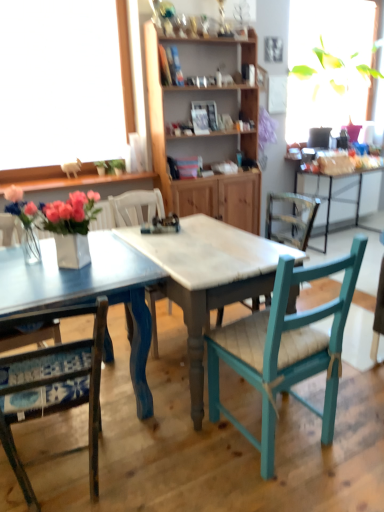
What do you see at coordinates (285, 349) in the screenshot? This screenshot has width=384, height=512. I see `teal wood chair at center, the 1th chair viewed from the right` at bounding box center [285, 349].

Measure the distance between teal wood chair at center, the 1th chair viewed from the right, and camera.

They are 4.40 feet apart.

Locate an element on the screen. wooden cabinet at center is located at coordinates (197, 138).

Describe the element at coordinates (209, 278) in the screenshot. I see `white marble table at center` at that location.

The height and width of the screenshot is (512, 384). Describe the element at coordinates (212, 438) in the screenshot. I see `blue painted wood table at center` at that location.

You are a GUI agent. You are given a task and a screenshot of the screen. Output one action in this format:
    pyautogui.click(x=<x>, y=<y>)
    Task: Click on the teal wood chair at center, the third chair when ordered from left to right
    The height and width of the screenshot is (512, 384).
    Given the screenshot: What is the action you would take?
    pyautogui.click(x=285, y=349)

From the picture: Which is more to the right, wooden cabinet at center or blue painted wood table at center?

wooden cabinet at center.

Between wooden cabinet at center and blue painted wood table at center, which one has smaller width?

wooden cabinet at center.

How different are the orientations of wooden cabinet at center and blue painted wood table at center in degrees?

The angular difference between wooden cabinet at center and blue painted wood table at center is 0.985 degrees.

Is wooden cabinet at center positioned with its back to blue painted wood table at center?

No, wooden cabinet at center's orientation is not away from blue painted wood table at center.

Considering the sizes of white marble table at center and wooden cabinet at center in the image, is white marble table at center taller or shorter than wooden cabinet at center?

In the image, white marble table at center appears to be shorter than wooden cabinet at center.

Would you say white marble table at center is to the left or to the right of wooden cabinet at center in the picture?

In the image, white marble table at center appears on the left side of wooden cabinet at center.

Does point (165, 294) lie behind point (157, 129)?

No, it is not.

From a real-world perspective, relative to wooden cabinet at center, is white marble table at center vertically above or below?

white marble table at center is situated lower than wooden cabinet at center in the real world.

At what (x,y) coordinates should I click in order to perform the action: click on cabinetry on the right side of wooden chair at center, which is the second chair in left-to-right order. Please return your answer as a coordinate pair (x, y). The image size is (384, 512). Looking at the image, I should click on (197, 138).

Between wooden cabinet at center and wooden chair at center, marked as the 2th chair in a right-to-left arrangement, which one has less height?

wooden chair at center, marked as the 2th chair in a right-to-left arrangement, is shorter.

Is wooden cabinet at center beside wooden chair at center, marked as the 2th chair in a right-to-left arrangement?

wooden cabinet at center and wooden chair at center, marked as the 2th chair in a right-to-left arrangement, are clearly separated.

Is wooden cabinet at center oriented towards wooden chair at center, which is the second chair in left-to-right order?

No, wooden cabinet at center is not facing towards wooden chair at center, which is the second chair in left-to-right order.

Are blue fabric cushioned chair at lower left, the third chair positioned from the right, and white glossy vase at center located far from each other?

No.

Can you tell me how much blue fabric cushioned chair at lower left, the 1th chair in the left-to-right sequence, and white glossy vase at center differ in facing direction?

blue fabric cushioned chair at lower left, the 1th chair in the left-to-right sequence, and white glossy vase at center are facing 129 degrees away from each other.

Where is `floral arrangement above the blue fabric cushioned chair at lower left, the 1th chair in the left-to-right sequence (from the image's perspective)`? floral arrangement above the blue fabric cushioned chair at lower left, the 1th chair in the left-to-right sequence (from the image's perspective) is located at coordinates (60, 222).

Is blue fabric cushioned chair at lower left, the third chair positioned from the right, turned away from white glossy vase at center?

No, white glossy vase at center is not at the back of blue fabric cushioned chair at lower left, the third chair positioned from the right.

How distant is blue fabric cushioned chair at lower left, the 1th chair in the left-to-right sequence, from white marble table at center?

blue fabric cushioned chair at lower left, the 1th chair in the left-to-right sequence, and white marble table at center are 25.18 inches apart from each other.

Relative to white marble table at center, is blue fabric cushioned chair at lower left, the third chair positioned from the right, in front or behind?

Clearly, blue fabric cushioned chair at lower left, the third chair positioned from the right, is in front of white marble table at center.

Where is `chair that is the 1st one above the white marble table at center (from a real-world perspective)`? chair that is the 1st one above the white marble table at center (from a real-world perspective) is located at coordinates (72, 378).

Does point (335, 349) come closer to viewer compared to point (208, 489)?

That is False.

Locate an element on the screen. This screenshot has height=512, width=384. chair to the right of blue painted wood table at center is located at coordinates (285, 349).

Does white glossy vase at center appear on the right side of blue painted wood table at center?

No, white glossy vase at center is not to the right of blue painted wood table at center.

Is white glossy vase at center outside of blue painted wood table at center?

Yes, white glossy vase at center is located beyond the bounds of blue painted wood table at center.

Is white glossy vase at center not near blue painted wood table at center?

No, white glossy vase at center is not far away from blue painted wood table at center.

Image resolution: width=384 pixels, height=512 pixels. What are the coordinates of `table in front of the wooden cabinet at center` in the screenshot? It's located at (212, 438).

Image resolution: width=384 pixels, height=512 pixels. Identify the location of cabinetry that appears behind the white marble table at center. (197, 138).

From the image, which object appears to be nearer to blue painted wood table at center, blue fabric cushioned chair at lower left, the 1th chair in the left-to-right sequence, or wooden cabinet at center?

blue fabric cushioned chair at lower left, the 1th chair in the left-to-right sequence, is positioned closer to the anchor blue painted wood table at center.

When comparing their distances from blue fabric cushioned chair at lower left, the third chair positioned from the right, does wooden chair at center, which is the second chair in left-to-right order, or teal wood chair at center, the third chair when ordered from left to right, seem further?

wooden chair at center, which is the second chair in left-to-right order, is positioned further to the anchor blue fabric cushioned chair at lower left, the third chair positioned from the right.

Looking at the image, which one is located further to white glossy vase at center, wooden chair at center, which is the second chair in left-to-right order, or wooden cabinet at center?

wooden cabinet at center is positioned further to the anchor white glossy vase at center.

Considering their positions, is blue painted wood table at center positioned further to white marble table at center than white glossy vase at center?

white glossy vase at center.

When comparing their distances from wooden chair at center, which is the second chair in left-to-right order, does blue fabric cushioned chair at lower left, the 1th chair in the left-to-right sequence, or white marble table at center seem closer?

Based on the image, white marble table at center appears to be nearer to wooden chair at center, which is the second chair in left-to-right order.

From the image, which object appears to be nearer to white marble table at center, wooden chair at center, which is the second chair in left-to-right order, or wooden cabinet at center?

Based on the image, wooden chair at center, which is the second chair in left-to-right order, appears to be nearer to white marble table at center.

Considering their positions, is blue painted wood table at center positioned closer to white glossy vase at center than wooden chair at center, marked as the 2th chair in a right-to-left arrangement?

The object closer to white glossy vase at center is wooden chair at center, marked as the 2th chair in a right-to-left arrangement.

Looking at this image, looking at the image, which one is located further to white glossy vase at center, teal wood chair at center, the third chair when ordered from left to right, or wooden cabinet at center?

wooden cabinet at center.

Where is `table located between blue fabric cushioned chair at lower left, the third chair positioned from the right, and teal wood chair at center, the 1th chair viewed from the right, in the left-right direction`? table located between blue fabric cushioned chair at lower left, the third chair positioned from the right, and teal wood chair at center, the 1th chair viewed from the right, in the left-right direction is located at coordinates (212, 438).

Locate an element on the screen. floral arrangement positioned between blue painted wood table at center and wooden chair at center, which is the second chair in left-to-right order, from near to far is located at coordinates (60, 222).

You are a GUI agent. You are given a task and a screenshot of the screen. Output one action in this format:
    pyautogui.click(x=<x>, y=<y>)
    Task: Click on the chair between white glossy vase at center and wooden cabinet at center along the z-axis
    
    Given the screenshot: What is the action you would take?
    pyautogui.click(x=136, y=207)

The width and height of the screenshot is (384, 512). I want to click on floral arrangement between teal wood chair at center, the 1th chair viewed from the right, and wooden chair at center, which is the second chair in left-to-right order, in the front-back direction, so click(60, 222).